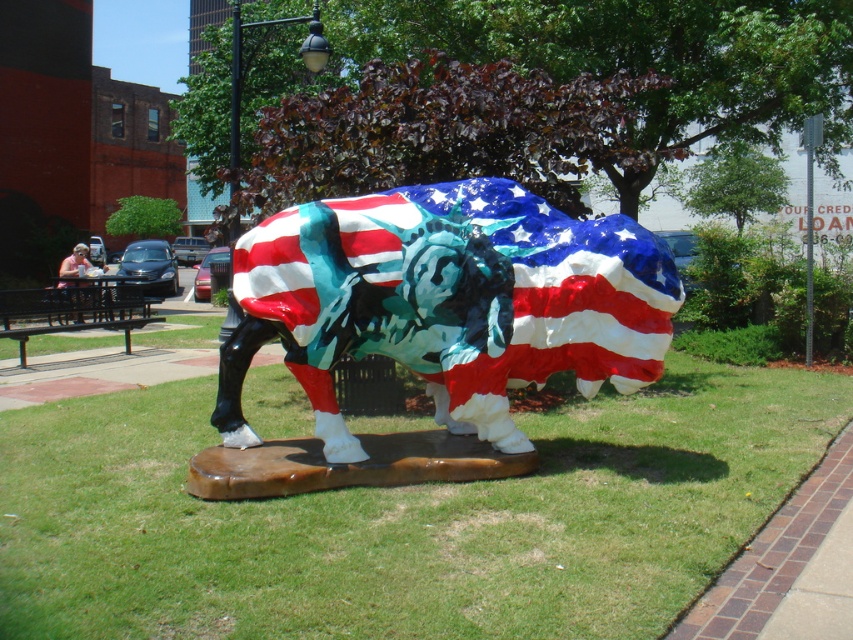
Does green grass at center have a lesser width compared to shiny metallic bull at center?

No.

Identify the location of green grass at center. (401, 518).